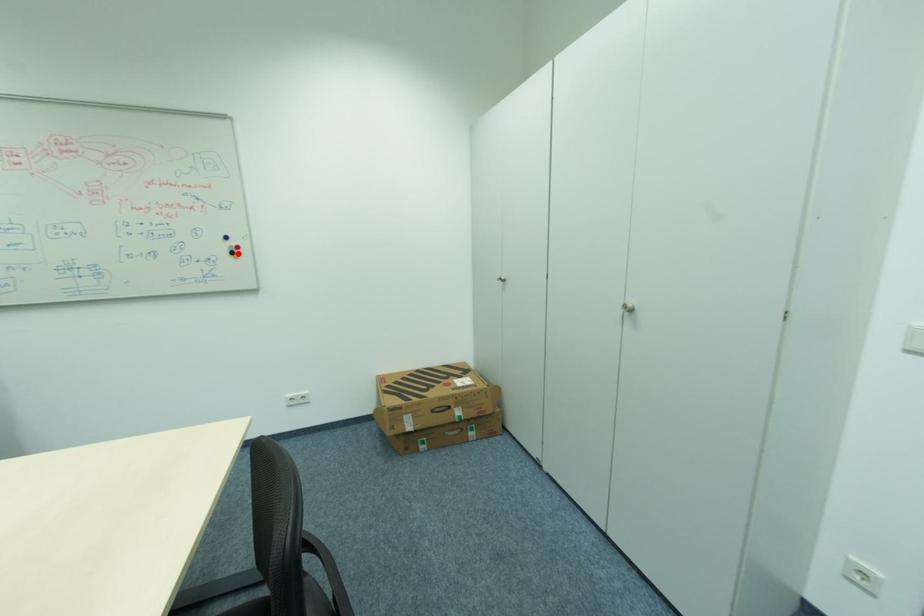
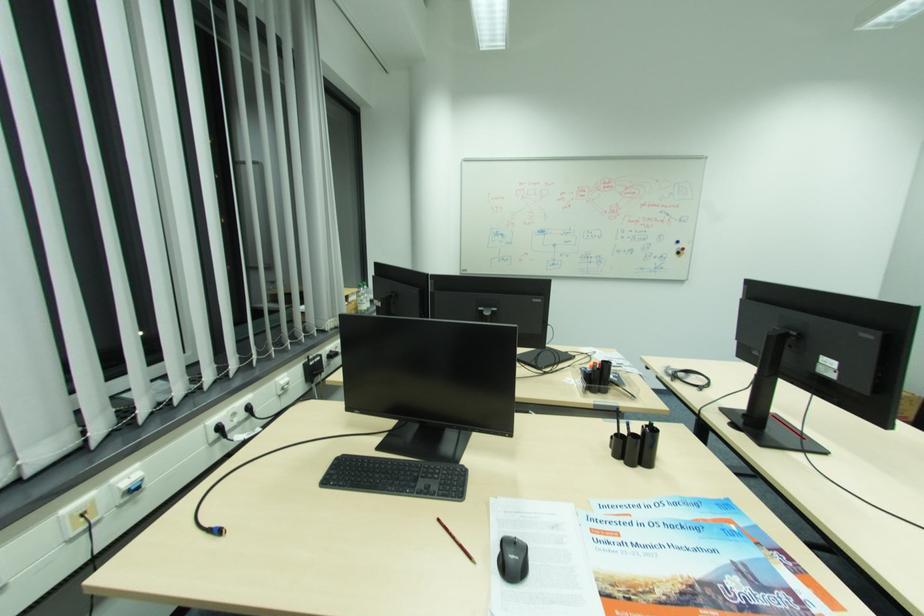
Find the pixel in the second image that matches the highlighted location in the first image.

(684, 253)